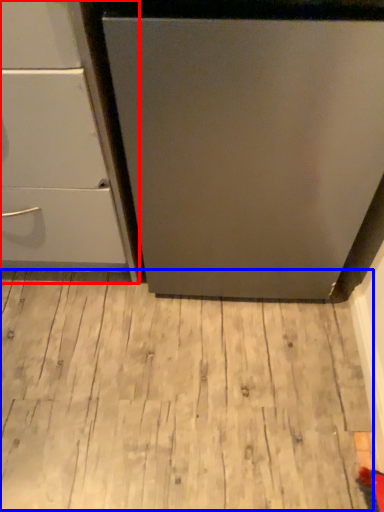
Question: Among these objects, which one is farthest to the camera, chest of drawers (highlighted by a red box) or hardwood (highlighted by a blue box)?

Choices:
 (A) chest of drawers
 (B) hardwood

Answer: (B)